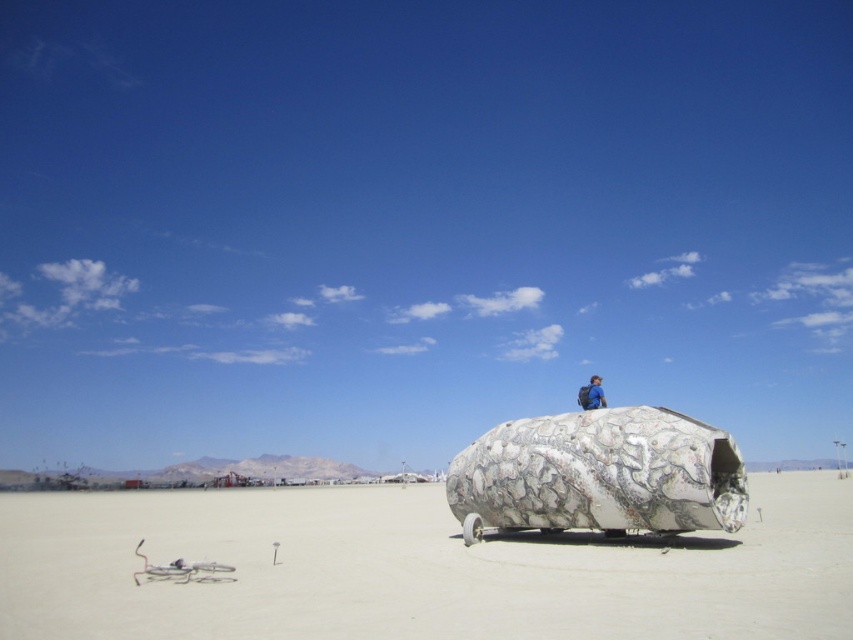
You are an explorer in the desert who needs to reach the blue backpack at center from the white sand at center. Can you walk directly to the backpack without any obstacles?

The white sand at center and blue backpack at center are 14.09 meters apart, so yes, you can walk directly to the blue backpack at center from the white sand at center as there are no mentioned obstacles between them.

You are standing at the point with coordinates 0.7, 0.5 in the image. You want to walk to the white sand at center. Which direction should you move in?

You should move towards the east direction to reach the white sand at center located at point [416,570].